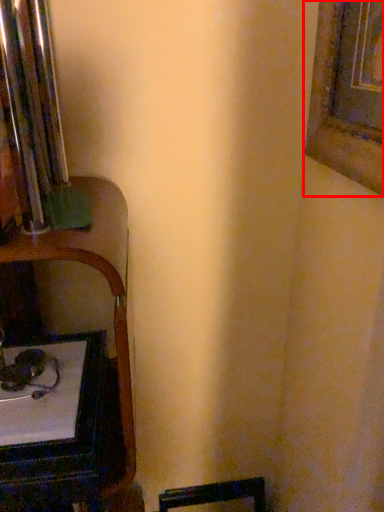
Question: From the image's perspective, what is the correct spatial relationship of picture frame (annotated by the red box) in relation to table?

Choices:
 (A) below
 (B) above

Answer: (B)